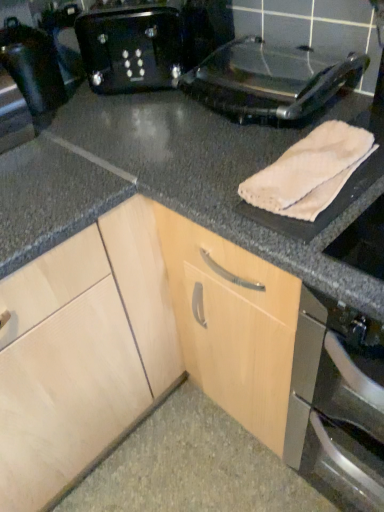
You are a GUI agent. You are given a task and a screenshot of the screen. Output one action in this format:
    pyautogui.click(x=<x>, y=<y>)
    Task: Click on the vacant area that is in front of beige soft towel at upper right
    The width and height of the screenshot is (384, 512).
    Given the screenshot: What is the action you would take?
    pyautogui.click(x=333, y=241)